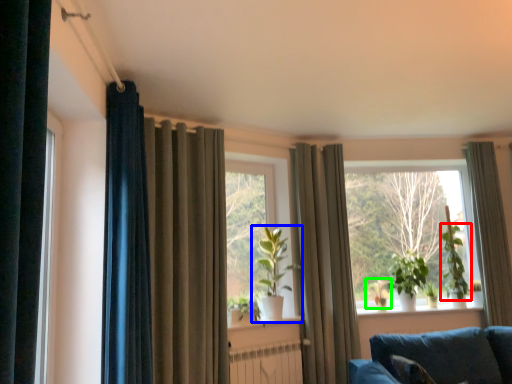
Question: Considering the real-world distances, which object is closest to plant (highlighted by a red box)? houseplant (highlighted by a blue box) or plant (highlighted by a green box).

Choices:
 (A) houseplant
 (B) plant

Answer: (B)